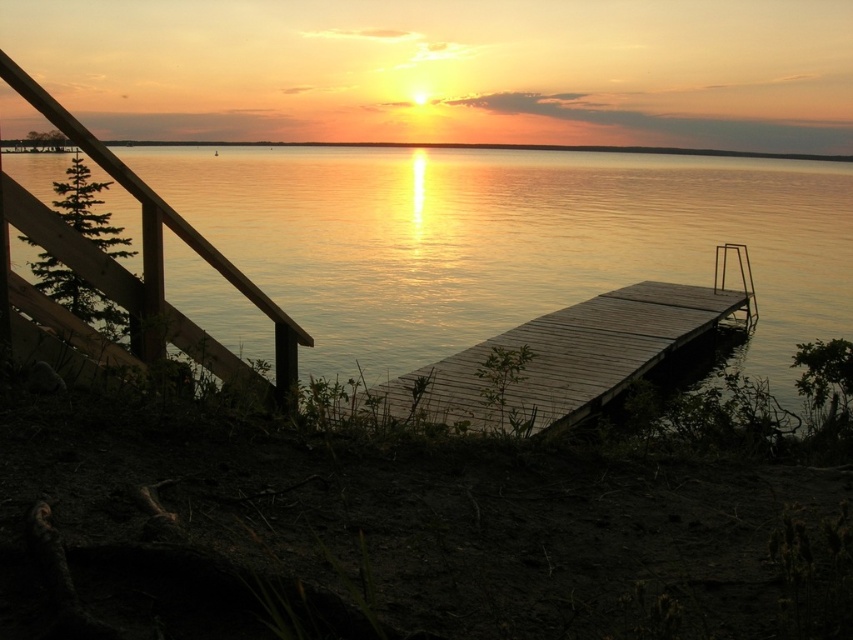
Question: Can you confirm if glistening water at center is positioned below wooden rail at left?

Choices:
 (A) no
 (B) yes

Answer: (A)

Question: Which of the following is the farthest from the observer?

Choices:
 (A) (752, 305)
 (B) (836, 296)

Answer: (B)

Question: Which of these objects is positioned closest to the wooden at center?

Choices:
 (A) glistening water at center
 (B) wooden rail at left

Answer: (B)

Question: Does glistening water at center appear on the left side of wooden rail at left?

Choices:
 (A) yes
 (B) no

Answer: (B)

Question: Which point is farther from the camera taking this photo?

Choices:
 (A) (402, 376)
 (B) (178, 234)
 (C) (57, 163)

Answer: (C)

Question: Is glistening water at center in front of wooden at center?

Choices:
 (A) no
 (B) yes

Answer: (A)